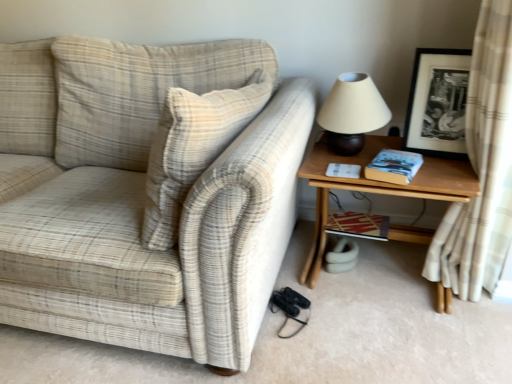
Question: Is hardcover book at right, the first book viewed from the front, in front of or behind matte beige lampshade at upper right in the image?

Choices:
 (A) behind
 (B) front

Answer: (B)

Question: Is hardcover book at right, which ranks as the 2th book in bottom-to-top order, taller or shorter than matte beige lampshade at upper right?

Choices:
 (A) tall
 (B) short

Answer: (B)

Question: Considering the real-world distances, which object is closest to the hardcover book at right, marked as the 1th book in a top-to-bottom arrangement?

Choices:
 (A) wooden table at right
 (B) striped paper book at lower right, which is counted as the 2th book, starting from the front
 (C) beige fabric curtain at right
 (D) beige plaid pillow at upper left
 (E) matte beige lampshade at upper right

Answer: (A)

Question: Which object is the farthest from the wooden table at right?

Choices:
 (A) hardcover book at right, marked as the 1th book in a top-to-bottom arrangement
 (B) striped paper book at lower right, which is counted as the 2th book, starting from the front
 (C) black matte picture frame at upper right
 (D) matte beige lampshade at upper right
 (E) beige fabric curtain at right

Answer: (B)